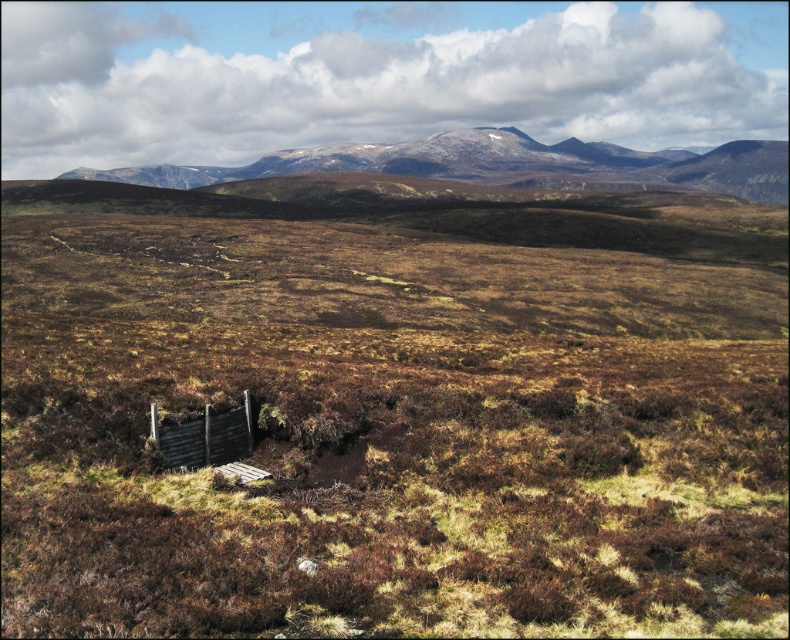
Is rugged brown mountain at upper center closer to the viewer compared to wooden fence at lower center?

No, rugged brown mountain at upper center is behind wooden fence at lower center.

Between point (668, 161) and point (247, 420), which one is positioned behind?

Positioned behind is point (668, 161).

You are a GUI agent. You are given a task and a screenshot of the screen. Output one action in this format:
    pyautogui.click(x=<x>, y=<y>)
    Task: Click on the rugged brown mountain at upper center
    
    Given the screenshot: What is the action you would take?
    pyautogui.click(x=503, y=164)